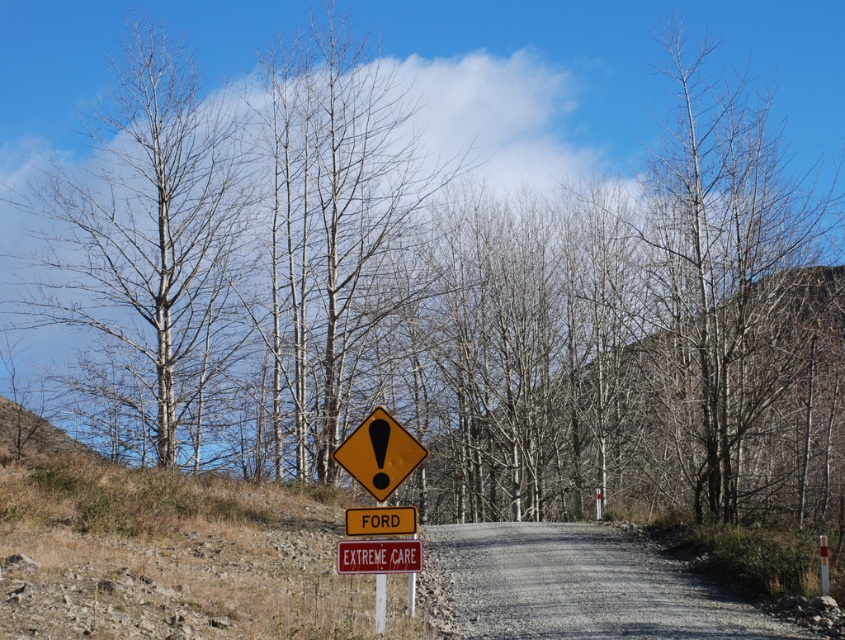
Is yellow matte triangle at center positioned at the back of white wood post at center?

No.

Between point (421, 452) and point (380, 627), which one is positioned behind?

The point (421, 452) is behind.

Identify the location of yellow matte triangle at center. (379, 452).

Measure the distance between point (x=390, y=492) and camera.

The distance of point (x=390, y=492) from camera is 34.27 feet.

Is yellow matte triangle at center closer to the viewer compared to yellow reflective plastic sign at center?

That is True.

Measure the distance between point (358, 445) and camera.

Point (358, 445) and camera are 34.41 feet apart from each other.

I want to click on yellow matte triangle at center, so click(379, 452).

Consider the image. Is gravel road at center to the right of yellow matte sign at center from the viewer's perspective?

Correct, you'll find gravel road at center to the right of yellow matte sign at center.

Where is `gravel road at center`? This screenshot has width=845, height=640. gravel road at center is located at coordinates (581, 586).